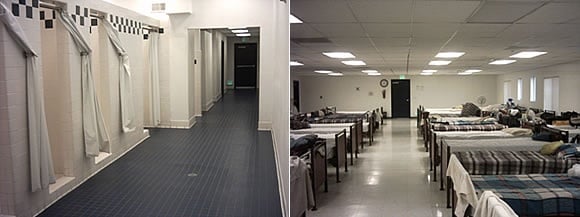
This screenshot has width=580, height=217. I want to click on pillows, so click(x=532, y=119).